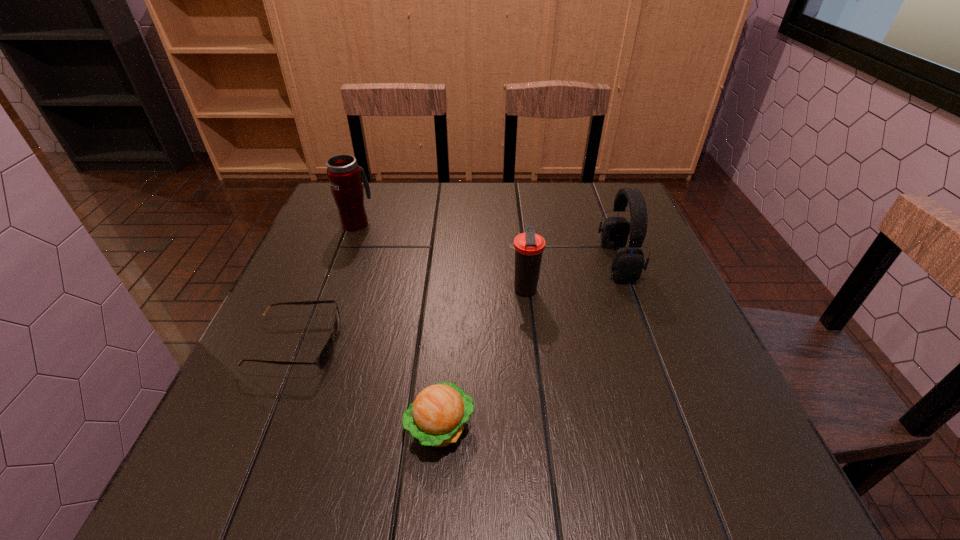
You are a GUI agent. You are given a task and a screenshot of the screen. Output one action in this format:
    pyautogui.click(x=<x>, y=<y>)
    Task: Click on the object that ranks as the second closest to the right thermos bottle
    The height and width of the screenshot is (540, 960).
    Given the screenshot: What is the action you would take?
    pyautogui.click(x=437, y=417)

This screenshot has height=540, width=960. What are the coordinates of `vacant region that satisfies the following two spatial constraints: 1. on the back side of the second shortest object; 2. on the right side of the right thermos bottle` in the screenshot? It's located at (450, 290).